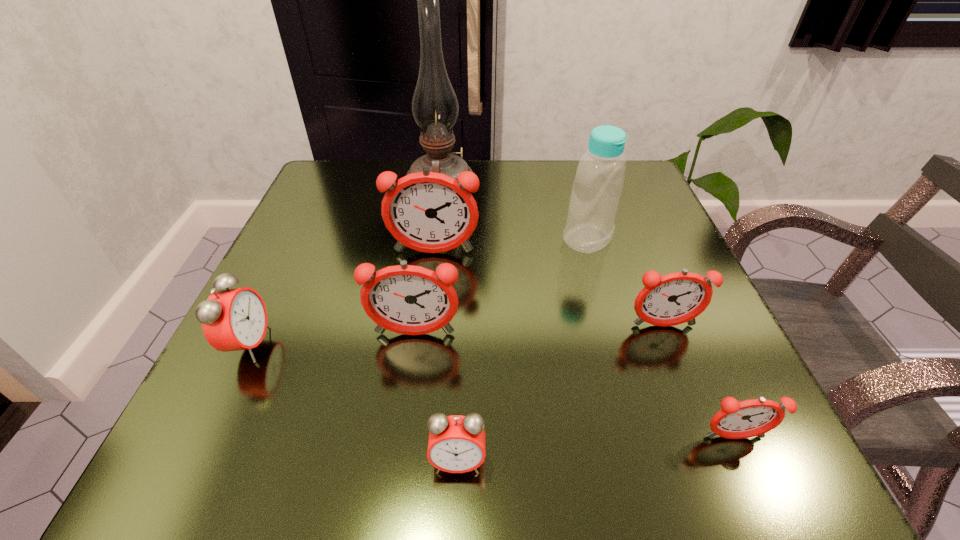
At what (x,y) coordinates should I click in order to perform the action: click on object that is at the far edge. Please return your answer as a coordinate pair (x, y). Looking at the image, I should click on (435, 108).

I want to click on object located in the left edge section of the desktop, so click(x=233, y=319).

Find the location of `bottle that is at the right edge`. bottle that is at the right edge is located at coordinates (599, 180).

Where is `object that is at the near right corner`? The image size is (960, 540). object that is at the near right corner is located at coordinates (736, 420).

The image size is (960, 540). Find the location of `free location at the far edge`. free location at the far edge is located at coordinates pyautogui.click(x=529, y=188).

This screenshot has width=960, height=540. What are the coordinates of `vacant space at the near edge of the desktop` in the screenshot? It's located at (632, 442).

In the image, there is a desktop. In order to click on vacant space at the left edge in this screenshot , I will do (301, 285).

You are a GUI agent. You are given a task and a screenshot of the screen. Output one action in this format:
    pyautogui.click(x=<x>, y=<y>)
    Task: Click on the vacant region at the right edge of the desktop
    
    Given the screenshot: What is the action you would take?
    pyautogui.click(x=634, y=265)

The image size is (960, 540). I want to click on blank space at the far left corner of the desktop, so click(331, 187).

You are a GUI agent. You are given a task and a screenshot of the screen. Output one action in this format:
    pyautogui.click(x=<x>, y=<y>)
    Task: Click on the vacant region at the near left corner of the desktop
    
    Given the screenshot: What is the action you would take?
    pyautogui.click(x=207, y=427)